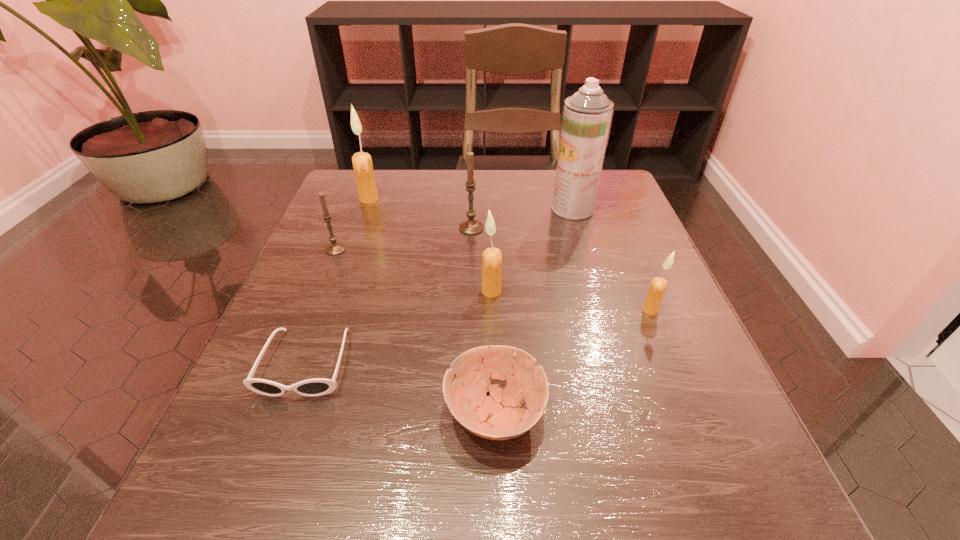
What are the coordinates of `the smaller gray candle` in the screenshot? It's located at (335, 248).

Find the location of `the third nearest candle`. the third nearest candle is located at coordinates (335, 248).

Where is `bowl`? This screenshot has width=960, height=540. bowl is located at coordinates (498, 416).

Find the location of a particular element. the seventh tallest object is located at coordinates (498, 416).

You are a GUI agent. You are given a task and a screenshot of the screen. Output one action in this format:
    pyautogui.click(x=<x>, y=<y>)
    Task: Click on the black sunglasses
    This screenshot has width=960, height=540.
    Given the screenshot: What is the action you would take?
    tap(315, 387)

Locate an element on the screen. the shortest object is located at coordinates (315, 387).

I want to click on vacant space located on the left of the seventh object from left to right, so click(469, 208).

At what (x,y) coordinates should I click in order to perform the action: click on vacant space located 0.070m on the right of the farthest candle. Please return your answer as a coordinate pair (x, y). The height and width of the screenshot is (540, 960). Looking at the image, I should click on (408, 199).

In order to click on free space located on the front of the second farthest candle in this screenshot , I will do `click(468, 342)`.

The height and width of the screenshot is (540, 960). I want to click on vacant position located 0.110m on the left of the fifth farthest object, so click(x=422, y=291).